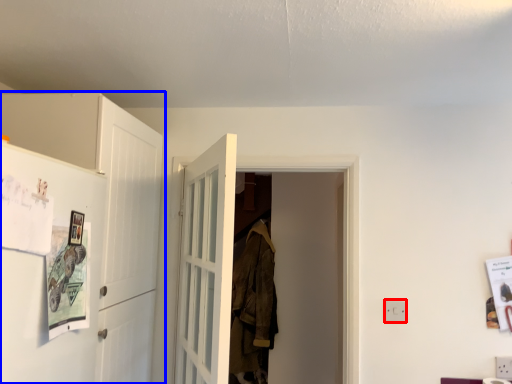
Question: Which object is closer to the camera taking this photo, electric outlet (highlighted by a red box) or cabinetry (highlighted by a blue box)?

Choices:
 (A) electric outlet
 (B) cabinetry

Answer: (B)